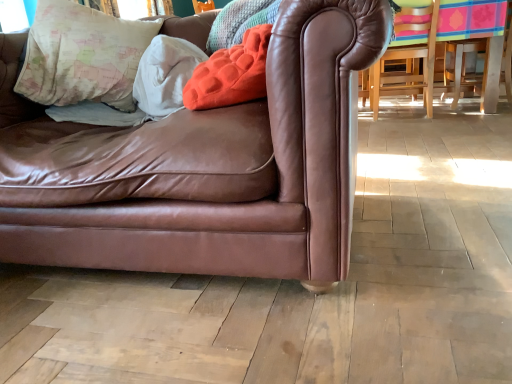
In order to face map-patterned fabric pillow at upper left, which ranks as the first pillow in left-to-right order, should I rotate leftwards or rightwards?

You should look left and rotate roughly 21.679 degrees.

Describe the element at coordinates (202, 167) in the screenshot. I see `brown leather couch at center` at that location.

This screenshot has width=512, height=384. I want to click on map-patterned fabric pillow at upper left, the third pillow positioned from the right, so click(82, 56).

Can you confirm if map-patterned fabric pillow at upper left, the third pillow positioned from the right, is wider than velvety orange pillow at upper center, marked as the first pillow in a right-to-left arrangement?

Indeed, map-patterned fabric pillow at upper left, the third pillow positioned from the right, has a greater width compared to velvety orange pillow at upper center, marked as the first pillow in a right-to-left arrangement.

From the image's perspective, which is below, map-patterned fabric pillow at upper left, which ranks as the first pillow in left-to-right order, or velvety orange pillow at upper center, marked as the first pillow in a right-to-left arrangement?

velvety orange pillow at upper center, marked as the first pillow in a right-to-left arrangement.

Is map-patterned fabric pillow at upper left, which ranks as the first pillow in left-to-right order, directly adjacent to velvety orange pillow at upper center, which appears as the 3th pillow when viewed from the left?

They are not placed beside each other.

Could you tell me if map-patterned fabric pillow at upper left, which ranks as the first pillow in left-to-right order, is turned towards velvety orange pillow at upper center, marked as the first pillow in a right-to-left arrangement?

No, map-patterned fabric pillow at upper left, which ranks as the first pillow in left-to-right order, is not facing towards velvety orange pillow at upper center, marked as the first pillow in a right-to-left arrangement.

From a real-world perspective, count 2nd pillows upward from the white soft pillow at upper left, which is the 2th pillow from left to right, and point to it. Please provide its 2D coordinates.

[(82, 56)]

What's the angular difference between map-patterned fabric pillow at upper left, which ranks as the first pillow in left-to-right order, and white soft pillow at upper left, the second pillow positioned from the right,'s facing directions?

map-patterned fabric pillow at upper left, which ranks as the first pillow in left-to-right order, and white soft pillow at upper left, the second pillow positioned from the right, are facing 0.00319 degrees away from each other.

Which object is closer to the camera taking this photo, map-patterned fabric pillow at upper left, the third pillow positioned from the right, or white soft pillow at upper left, which is the 2th pillow from left to right?

map-patterned fabric pillow at upper left, the third pillow positioned from the right, is more forward.

Which of these two, map-patterned fabric pillow at upper left, the third pillow positioned from the right, or white soft pillow at upper left, which is the 2th pillow from left to right, stands taller?

With more height is map-patterned fabric pillow at upper left, the third pillow positioned from the right.

Does white soft pillow at upper left, the second pillow positioned from the right, have a smaller size compared to brown leather couch at center?

Indeed, white soft pillow at upper left, the second pillow positioned from the right, has a smaller size compared to brown leather couch at center.

Between white soft pillow at upper left, the second pillow positioned from the right, and brown leather couch at center, which one has more height?

Standing taller between the two is brown leather couch at center.

Is brown leather couch at center at the back of white soft pillow at upper left, the second pillow positioned from the right?

Yes, brown leather couch at center is at the back of white soft pillow at upper left, the second pillow positioned from the right.

Which is in front, white soft pillow at upper left, the second pillow positioned from the right, or brown leather couch at center?

brown leather couch at center is more forward.

In the image, is velvety orange pillow at upper center, marked as the first pillow in a right-to-left arrangement, positioned in front of or behind map-patterned fabric pillow at upper left, which ranks as the first pillow in left-to-right order?

In the image, velvety orange pillow at upper center, marked as the first pillow in a right-to-left arrangement, appears in front of map-patterned fabric pillow at upper left, which ranks as the first pillow in left-to-right order.

Can you confirm if velvety orange pillow at upper center, which appears as the 3th pillow when viewed from the left, is positioned to the right of map-patterned fabric pillow at upper left, which ranks as the first pillow in left-to-right order?

Correct, you'll find velvety orange pillow at upper center, which appears as the 3th pillow when viewed from the left, to the right of map-patterned fabric pillow at upper left, which ranks as the first pillow in left-to-right order.

Between velvety orange pillow at upper center, marked as the first pillow in a right-to-left arrangement, and map-patterned fabric pillow at upper left, which ranks as the first pillow in left-to-right order, which one has larger width?

Wider between the two is map-patterned fabric pillow at upper left, which ranks as the first pillow in left-to-right order.

Is map-patterned fabric pillow at upper left, the third pillow positioned from the right, positioned far away from brown leather couch at center?

No.

Could you tell me if map-patterned fabric pillow at upper left, which ranks as the first pillow in left-to-right order, is turned towards brown leather couch at center?

Yes, map-patterned fabric pillow at upper left, which ranks as the first pillow in left-to-right order, is oriented towards brown leather couch at center.

Looking at this image, between map-patterned fabric pillow at upper left, which ranks as the first pillow in left-to-right order, and brown leather couch at center, which one has less height?

Standing shorter between the two is map-patterned fabric pillow at upper left, which ranks as the first pillow in left-to-right order.

Consider the image. Which is correct: map-patterned fabric pillow at upper left, the third pillow positioned from the right, is inside brown leather couch at center, or outside of it?

map-patterned fabric pillow at upper left, the third pillow positioned from the right, can be found inside brown leather couch at center.

From a real-world perspective, is brown leather couch at center physically below map-patterned fabric pillow at upper left, the third pillow positioned from the right?

Yes, from a real-world perspective, brown leather couch at center is below map-patterned fabric pillow at upper left, the third pillow positioned from the right.

How different are the orientations of brown leather couch at center and map-patterned fabric pillow at upper left, which ranks as the first pillow in left-to-right order, in degrees?

They differ by 0.000358 degrees in their facing directions.

How distant is brown leather couch at center from map-patterned fabric pillow at upper left, the third pillow positioned from the right?

The distance of brown leather couch at center from map-patterned fabric pillow at upper left, the third pillow positioned from the right, is 38.62 centimeters.

From the image's perspective, is brown leather couch at center located above or below map-patterned fabric pillow at upper left, which ranks as the first pillow in left-to-right order?

brown leather couch at center is below map-patterned fabric pillow at upper left, which ranks as the first pillow in left-to-right order.

Can you tell me how much white soft pillow at upper left, which is the 2th pillow from left to right, and map-patterned fabric pillow at upper left, which ranks as the first pillow in left-to-right order, differ in facing direction?

The facing directions of white soft pillow at upper left, which is the 2th pillow from left to right, and map-patterned fabric pillow at upper left, which ranks as the first pillow in left-to-right order, are 0.00319 degrees apart.

Based on the photo, is white soft pillow at upper left, the second pillow positioned from the right, aimed at map-patterned fabric pillow at upper left, the third pillow positioned from the right?

No, white soft pillow at upper left, the second pillow positioned from the right, is not turned towards map-patterned fabric pillow at upper left, the third pillow positioned from the right.

Which object is wider, white soft pillow at upper left, which is the 2th pillow from left to right, or map-patterned fabric pillow at upper left, which ranks as the first pillow in left-to-right order?

With larger width is map-patterned fabric pillow at upper left, which ranks as the first pillow in left-to-right order.

From a real-world perspective, who is located lower, white soft pillow at upper left, the second pillow positioned from the right, or map-patterned fabric pillow at upper left, which ranks as the first pillow in left-to-right order?

white soft pillow at upper left, the second pillow positioned from the right.

The height and width of the screenshot is (384, 512). In order to click on the 2nd pillow counting from the right of the map-patterned fabric pillow at upper left, the third pillow positioned from the right in this screenshot , I will do `click(231, 73)`.

Find the location of a particular element. pillow that is the 2nd object directly below the map-patterned fabric pillow at upper left, which ranks as the first pillow in left-to-right order (from a real-world perspective) is located at coordinates (165, 75).

When comparing their distances from white soft pillow at upper left, which is the 2th pillow from left to right, does brown leather couch at center or velvety orange pillow at upper center, marked as the first pillow in a right-to-left arrangement, seem closer?

velvety orange pillow at upper center, marked as the first pillow in a right-to-left arrangement, is closer to white soft pillow at upper left, which is the 2th pillow from left to right.

Considering their positions, is white soft pillow at upper left, which is the 2th pillow from left to right, positioned further to velvety orange pillow at upper center, marked as the first pillow in a right-to-left arrangement, than map-patterned fabric pillow at upper left, which ranks as the first pillow in left-to-right order?

map-patterned fabric pillow at upper left, which ranks as the first pillow in left-to-right order, lies further to velvety orange pillow at upper center, marked as the first pillow in a right-to-left arrangement, than the other object.

From the image, which object appears to be farther from brown leather couch at center, white soft pillow at upper left, the second pillow positioned from the right, or velvety orange pillow at upper center, marked as the first pillow in a right-to-left arrangement?

Based on the image, white soft pillow at upper left, the second pillow positioned from the right, appears to be further to brown leather couch at center.

Which object lies further to the anchor point map-patterned fabric pillow at upper left, the third pillow positioned from the right, velvety orange pillow at upper center, marked as the first pillow in a right-to-left arrangement, or white soft pillow at upper left, the second pillow positioned from the right?

velvety orange pillow at upper center, marked as the first pillow in a right-to-left arrangement, is further to map-patterned fabric pillow at upper left, the third pillow positioned from the right.

Estimate the real-world distances between objects in this image. Which object is further from velvety orange pillow at upper center, marked as the first pillow in a right-to-left arrangement, brown leather couch at center or white soft pillow at upper left, which is the 2th pillow from left to right?

Based on the image, brown leather couch at center appears to be further to velvety orange pillow at upper center, marked as the first pillow in a right-to-left arrangement.

From the picture: Looking at the image, which one is located further to brown leather couch at center, white soft pillow at upper left, which is the 2th pillow from left to right, or map-patterned fabric pillow at upper left, which ranks as the first pillow in left-to-right order?

white soft pillow at upper left, which is the 2th pillow from left to right, is further to brown leather couch at center.

When comparing their distances from white soft pillow at upper left, which is the 2th pillow from left to right, does velvety orange pillow at upper center, marked as the first pillow in a right-to-left arrangement, or map-patterned fabric pillow at upper left, the third pillow positioned from the right, seem closer?

Result: map-patterned fabric pillow at upper left, the third pillow positioned from the right, is closer to white soft pillow at upper left, which is the 2th pillow from left to right.

From the image, which object appears to be nearer to brown leather couch at center, velvety orange pillow at upper center, marked as the first pillow in a right-to-left arrangement, or white soft pillow at upper left, the second pillow positioned from the right?

velvety orange pillow at upper center, marked as the first pillow in a right-to-left arrangement.

Where is `pillow situated between map-patterned fabric pillow at upper left, which ranks as the first pillow in left-to-right order, and velvety orange pillow at upper center, which appears as the 3th pillow when viewed from the left, from left to right`? The height and width of the screenshot is (384, 512). pillow situated between map-patterned fabric pillow at upper left, which ranks as the first pillow in left-to-right order, and velvety orange pillow at upper center, which appears as the 3th pillow when viewed from the left, from left to right is located at coordinates (165, 75).

Identify the location of pillow positioned between brown leather couch at center and map-patterned fabric pillow at upper left, which ranks as the first pillow in left-to-right order, from near to far. The height and width of the screenshot is (384, 512). click(x=231, y=73).